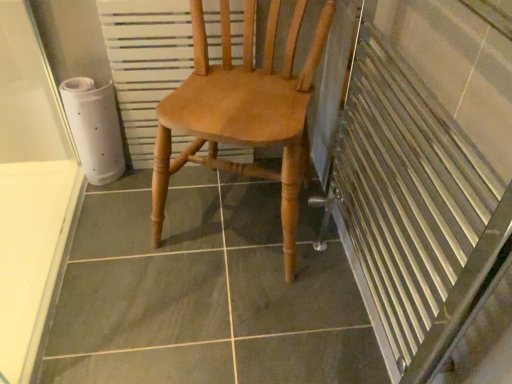
This screenshot has height=384, width=512. I want to click on free space in front of white textured radiator at center, so (x=180, y=206).